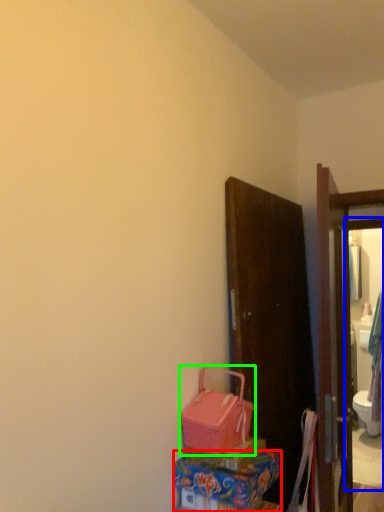
Question: Which object is positioned closest to box (highlighted by a red box)? Select from mirror (highlighted by a blue box) and luggage (highlighted by a green box).

Choices:
 (A) mirror
 (B) luggage

Answer: (B)